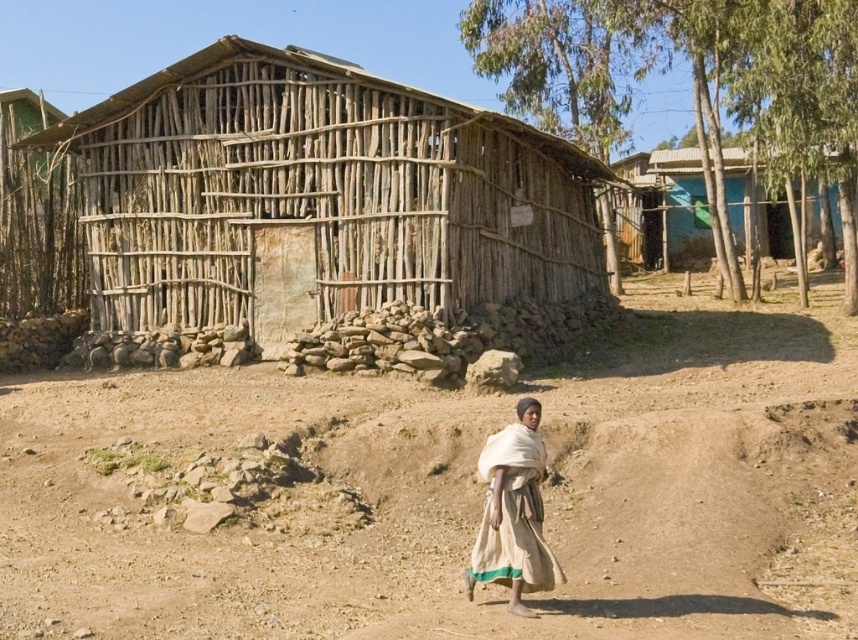
Does natural wood hut at center have a lesser height compared to beige fabric shawl at lower right?

No, natural wood hut at center is not shorter than beige fabric shawl at lower right.

Can you confirm if natural wood hut at center is positioned to the left of beige fabric shawl at lower right?

Correct, you'll find natural wood hut at center to the left of beige fabric shawl at lower right.

Is point (133, 278) positioned in front of point (479, 566)?

No, it is not.

Locate an element on the screen. The height and width of the screenshot is (640, 858). natural wood hut at center is located at coordinates (317, 195).

The width and height of the screenshot is (858, 640). I want to click on brown sandy dirt field at lower center, so click(x=437, y=506).

Between brown sandy dirt field at lower center and blue painted wood at upper right, which one has more height?

blue painted wood at upper right is taller.

Image resolution: width=858 pixels, height=640 pixels. Find the location of `brown sandy dirt field at lower center`. brown sandy dirt field at lower center is located at coordinates (437, 506).

Is natural wood hut at center bigger than blue painted wood at upper right?

Actually, natural wood hut at center might be smaller than blue painted wood at upper right.

Who is lower down, natural wood hut at center or blue painted wood at upper right?

natural wood hut at center

You are a GUI agent. You are given a task and a screenshot of the screen. Output one action in this format:
    pyautogui.click(x=<x>, y=<y>)
    Task: Click on the natural wood hut at center
    Image resolution: width=858 pixels, height=640 pixels.
    Given the screenshot: What is the action you would take?
    pyautogui.click(x=317, y=195)